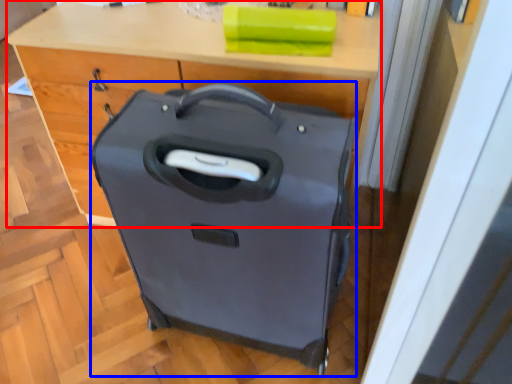
Question: Which of the following is the farthest to the observer, computer desk (highlighted by a red box) or suitcase (highlighted by a blue box)?

Choices:
 (A) computer desk
 (B) suitcase

Answer: (A)